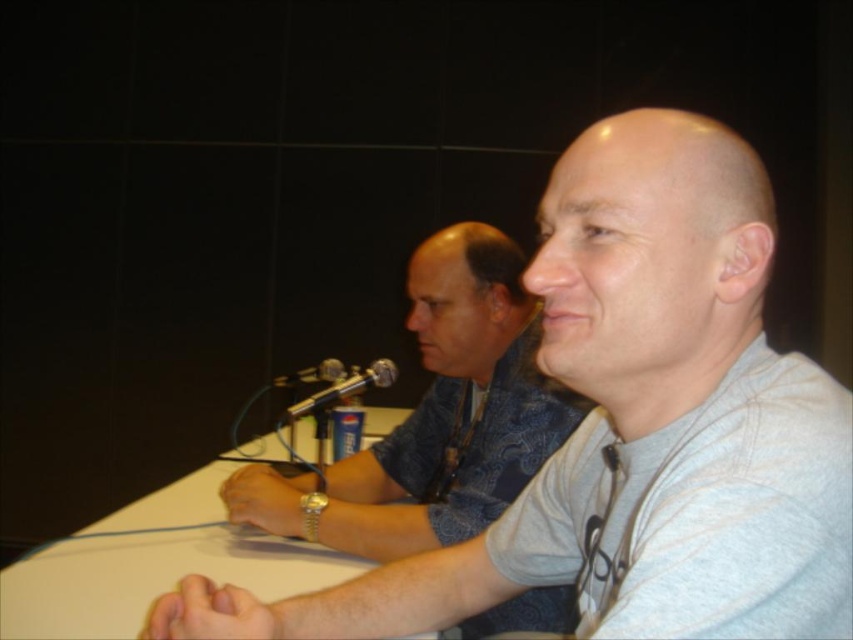
Question: Among these points, which one is nearest to the camera?

Choices:
 (A) (294, 380)
 (B) (368, 372)
 (C) (691, 476)

Answer: (C)

Question: Is gray fabric shirt at center below black metallic microphone at center?

Choices:
 (A) no
 (B) yes

Answer: (B)

Question: Estimate the real-world distances between objects in this image. Which object is closer to the gray fabric shirt at center?

Choices:
 (A) metallic silver microphone at center
 (B) black metallic microphone at center
 (C) gray cotton shirt at center

Answer: (A)

Question: Which is nearer to the metallic silver microphone at center?

Choices:
 (A) black metallic microphone at center
 (B) gray fabric shirt at center

Answer: (A)

Question: Is gray cotton shirt at center positioned behind metallic silver microphone at center?

Choices:
 (A) no
 (B) yes

Answer: (A)

Question: Is gray fabric shirt at center positioned behind black metallic microphone at center?

Choices:
 (A) no
 (B) yes

Answer: (A)